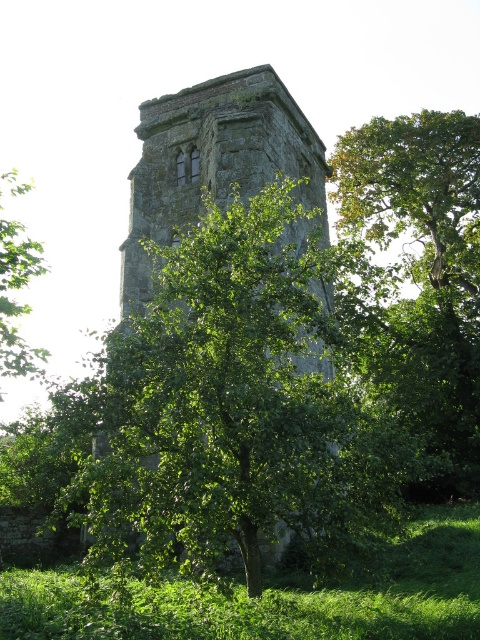
Question: Which point appears farthest from the camera in this image?

Choices:
 (A) (448, 180)
 (B) (4, 330)
 (C) (259, 136)

Answer: (A)

Question: Does green leafy tree at center appear over green leafy tree at left?

Choices:
 (A) no
 (B) yes

Answer: (B)

Question: Does stone tower at center appear over green leafy tree at left?

Choices:
 (A) yes
 (B) no

Answer: (B)

Question: Which object is the closest to the green leafy tree at left?

Choices:
 (A) stone tower at center
 (B) green leafy tree at center

Answer: (A)

Question: Which of the following is the closest to the observer?

Choices:
 (A) (16, 188)
 (B) (314, 195)
 (C) (477, 468)

Answer: (B)

Question: From the image, what is the correct spatial relationship of stone tower at center in relation to green leafy tree at left?

Choices:
 (A) left
 (B) right

Answer: (B)